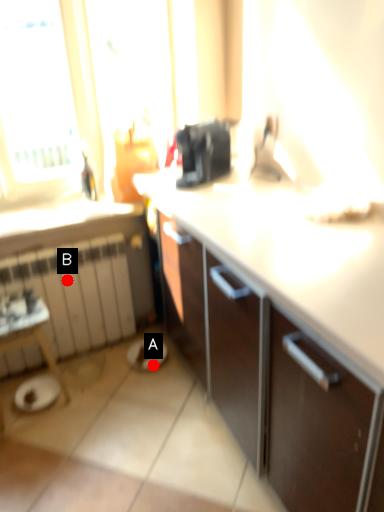
Question: Two points are circled on the image, labeled by A and B beside each circle. Among these points, which one is farthest from the camera?

Choices:
 (A) A is further
 (B) B is further

Answer: (A)